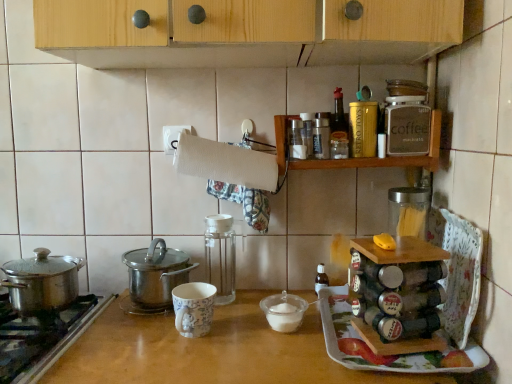
Where is `blank space situated above metallic silver spice rack at center right, the first appliance when ordered from right to left (from a real-world perspective)`? blank space situated above metallic silver spice rack at center right, the first appliance when ordered from right to left (from a real-world perspective) is located at coordinates tap(397, 245).